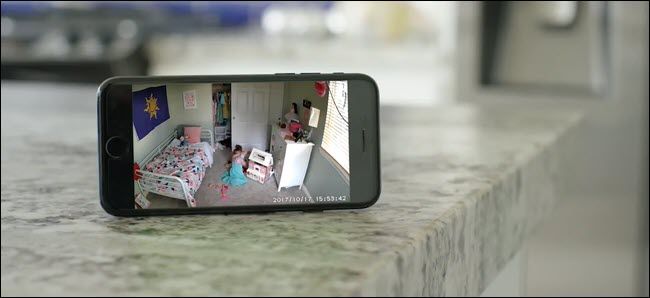
This screenshot has width=650, height=298. What are the coordinates of `counter top` in the screenshot? It's located at (383, 244).